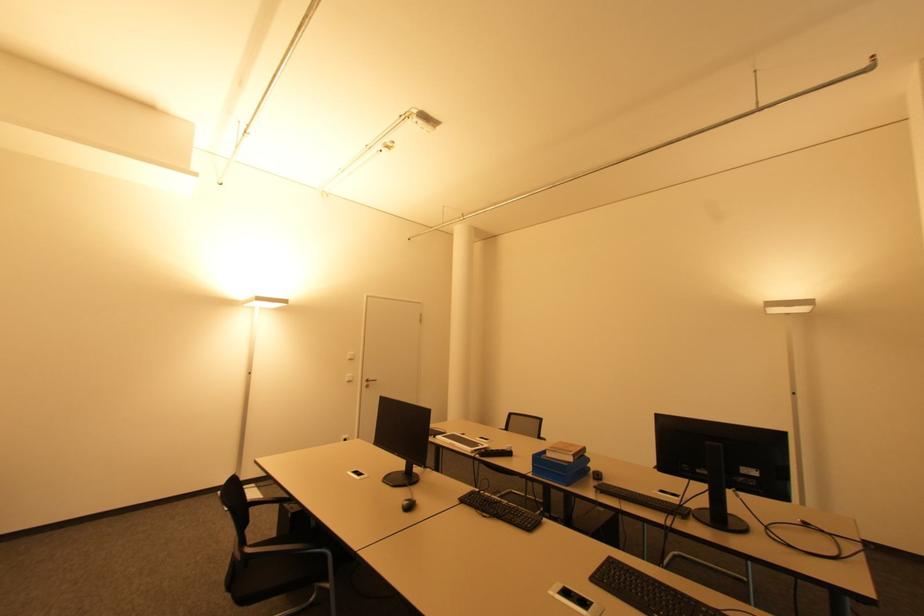
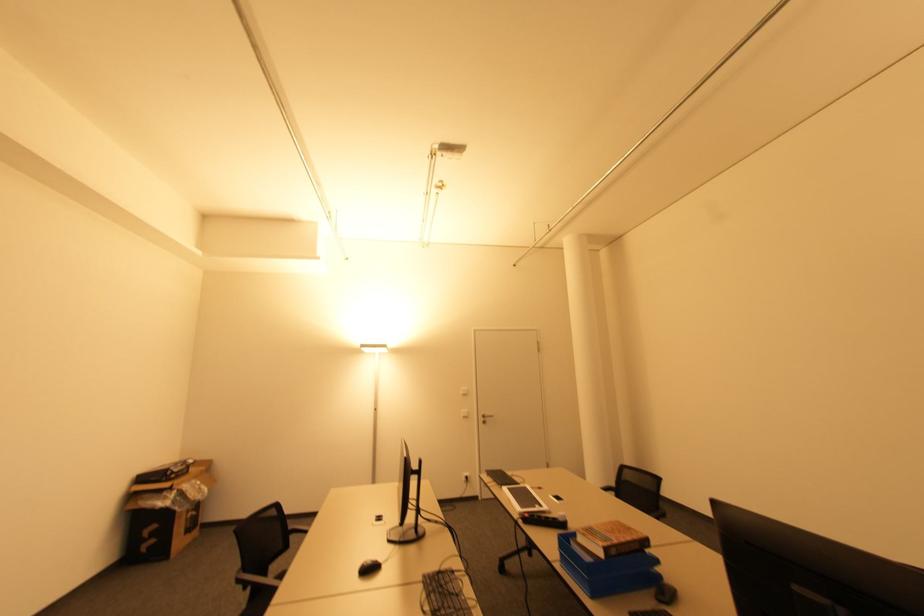
The point at (354, 359) is marked in the first image. Where is the corresponding point in the second image?

(468, 392)